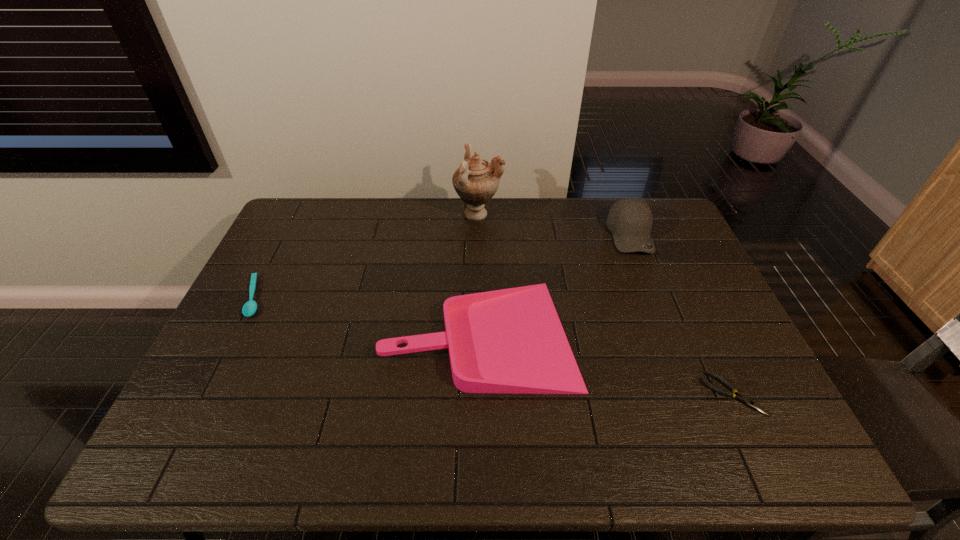
At what (x,y) coordinates should I click in order to perform the action: click on vacant space that is in between the pliers and the third tallest object. Please return your answer as a coordinate pair (x, y). Looking at the image, I should click on (606, 363).

Locate an element on the screen. This screenshot has width=960, height=540. free space between the pliers and the tallest object is located at coordinates (606, 304).

You are a GUI agent. You are given a task and a screenshot of the screen. Output one action in this format:
    pyautogui.click(x=<x>, y=<y>)
    Task: Click on the object that stands as the fourth closest to the leftmost object
    
    Given the screenshot: What is the action you would take?
    pyautogui.click(x=741, y=398)

Identify which object is located as the fourth nearest to the third shortest object. Please provide its 2D coordinates. Your answer should be formatted as a tuple, i.e. [(x, y)], where the tuple contains the x and y coordinates of a point satisfying the conditions above.

[(250, 307)]

Locate an element on the screen. This screenshot has height=540, width=960. blank space that satisfies the following two spatial constraints: 1. on the handle side of the pliers; 2. on the left side of the dustpan is located at coordinates (480, 394).

Locate an element on the screen. Image resolution: width=960 pixels, height=540 pixels. free spot that satisfies the following two spatial constraints: 1. on the front side of the pliers; 2. on the right side of the urn is located at coordinates click(478, 394).

At what (x,y) coordinates should I click in order to perform the action: click on vacant space that satisfies the following two spatial constraints: 1. on the handle side of the pliers; 2. on the left side of the dustpan. Please return your answer as a coordinate pair (x, y). Image resolution: width=960 pixels, height=540 pixels. Looking at the image, I should click on (480, 394).